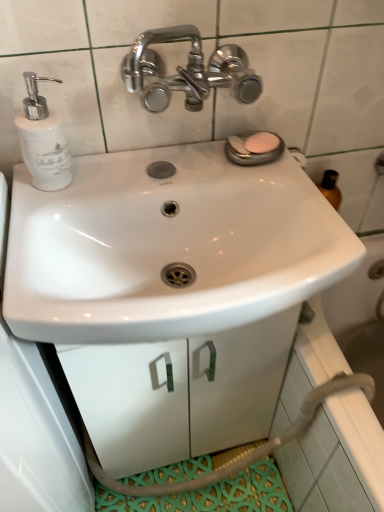
Where is `vacant area that is in front of white glossy soap dispenser at left`? The height and width of the screenshot is (512, 384). vacant area that is in front of white glossy soap dispenser at left is located at coordinates (38, 224).